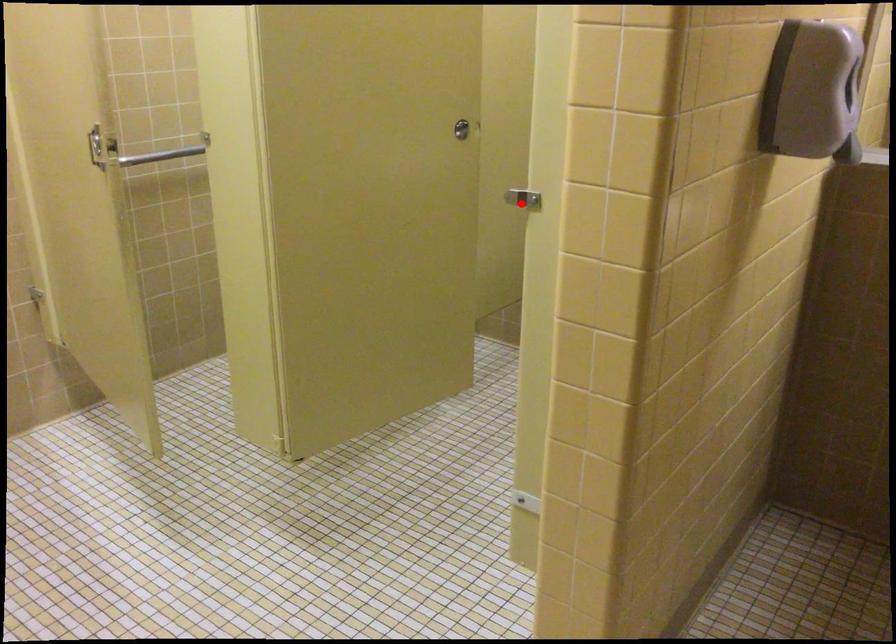
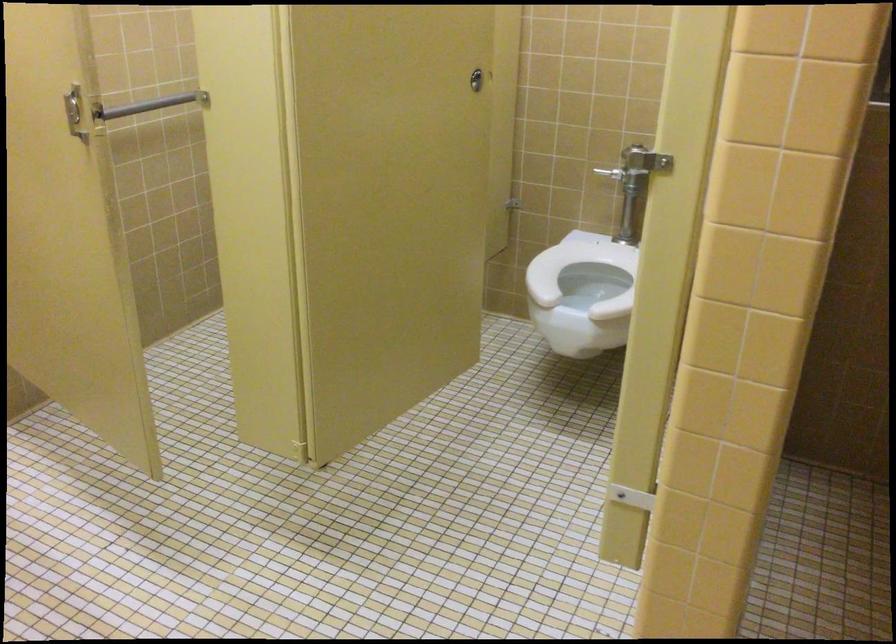
In the second image, find the point that corresponds to the highlighted location in the first image.

(644, 160)